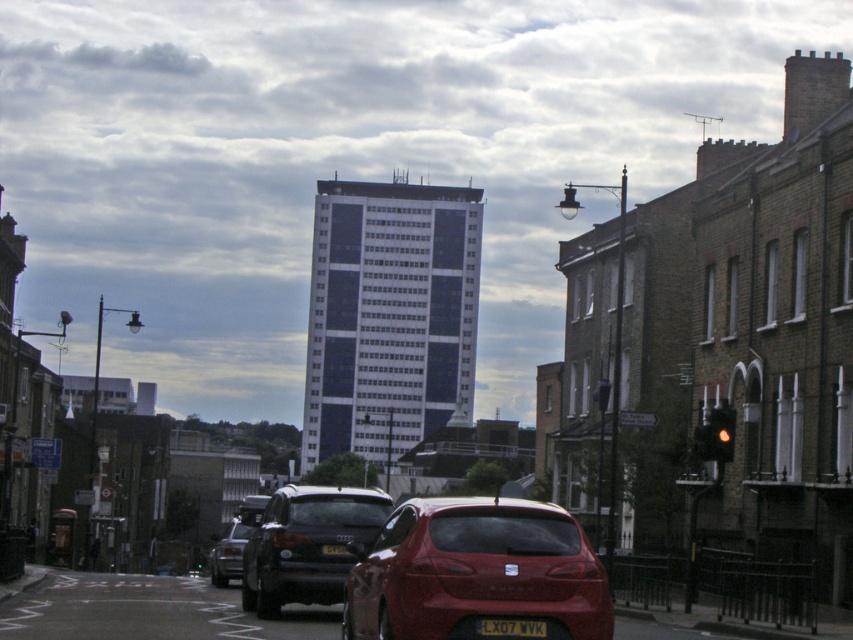
Describe the element at coordinates (476, 572) in the screenshot. Image resolution: width=853 pixels, height=640 pixels. I see `shiny red hatchback at center` at that location.

Does shiny red hatchback at center have a greater height compared to yellow matte license plate at center?

Correct, shiny red hatchback at center is much taller as yellow matte license plate at center.

Between point (355, 595) and point (331, 548), which one is positioned behind?

The point (331, 548) is more distant.

You are a GUI agent. You are given a task and a screenshot of the screen. Output one action in this format:
    pyautogui.click(x=<x>, y=<y>)
    Task: Click on the shiny red hatchback at center
    This screenshot has height=640, width=853.
    Given the screenshot: What is the action you would take?
    pyautogui.click(x=476, y=572)

Is shiny black car at center wider than black plastic license plate at center?

Yes.

Does point (322, 588) come in front of point (543, 634)?

That is False.

I want to click on shiny black car at center, so click(x=306, y=545).

Which is below, shiny red hatchback at center or shiny black sedan at center?

shiny black sedan at center is lower down.

Identify the location of shiny red hatchback at center. This screenshot has height=640, width=853. (476, 572).

This screenshot has width=853, height=640. I want to click on shiny red hatchback at center, so click(x=476, y=572).